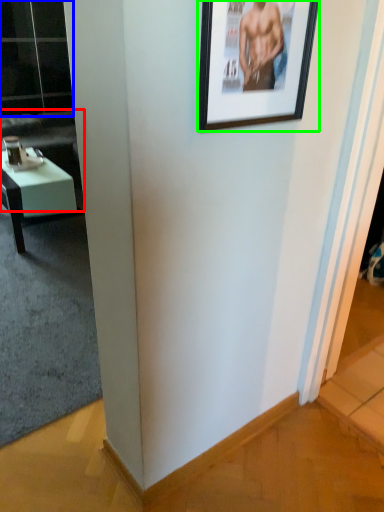
Question: Which object is the closest to the couch (highlighted by a red box)? Choose among these: glass door (highlighted by a blue box) or picture frame (highlighted by a green box).

Choices:
 (A) glass door
 (B) picture frame

Answer: (A)